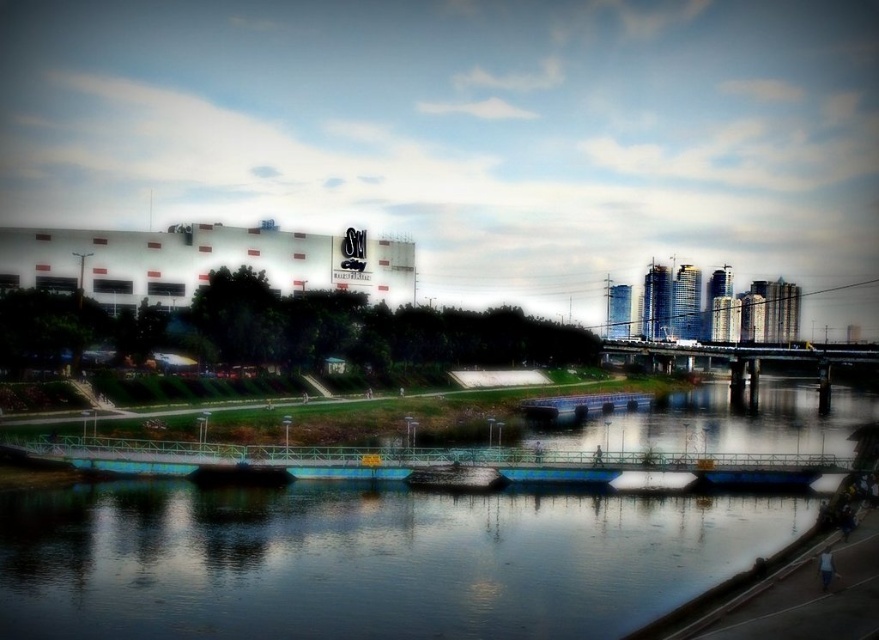
You are standing on the pedestrian bridge and want to take a photo of the blue smooth water at center and the shiny dark wood boat at center. Which object should you focus on first if you want to capture both in a single frame without moving the camera?

You should focus on the blue smooth water at center first because it is larger in size than the shiny dark wood boat at center, allowing it to dominate the frame while still including the boat.

In the scene shown: You are a photographer planning to capture the reflection of the shiny dark wood boat at center in the blue smooth water at center. Based on the scene, can you confirm if the boat is positioned in a way that its reflection would be clearly visible in the water?

The blue smooth water at center is positioned under the shiny dark wood boat at center, so the boat is directly above the water. Since the water is smooth, it should provide a clear reflection of the boat.

You are standing on the pedestrian bridge with turquoise railing and want to locate the blue smooth water at center. According to the coordinates provided, where exactly would you look?

The blue smooth water at center is located at coordinates point (365, 561).